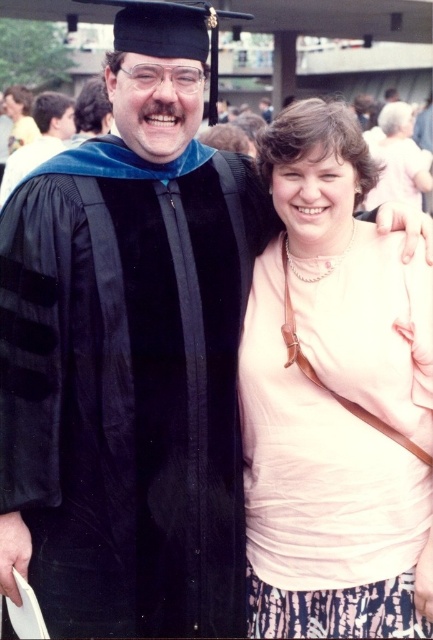
Question: Is pink fabric shirt at center above matte black graduation gown at upper left?

Choices:
 (A) no
 (B) yes

Answer: (A)

Question: Is pink fabric shirt at center below matte black graduation gown at upper left?

Choices:
 (A) yes
 (B) no

Answer: (A)

Question: Is pink fabric shirt at center thinner than matte black graduation gown at upper left?

Choices:
 (A) no
 (B) yes

Answer: (B)

Question: Which point is farther to the camera?

Choices:
 (A) (58, 113)
 (B) (429, 552)

Answer: (A)

Question: Which point is farther to the camera?

Choices:
 (A) matte black graduation gown at upper left
 (B) pink fabric shirt at center

Answer: (A)